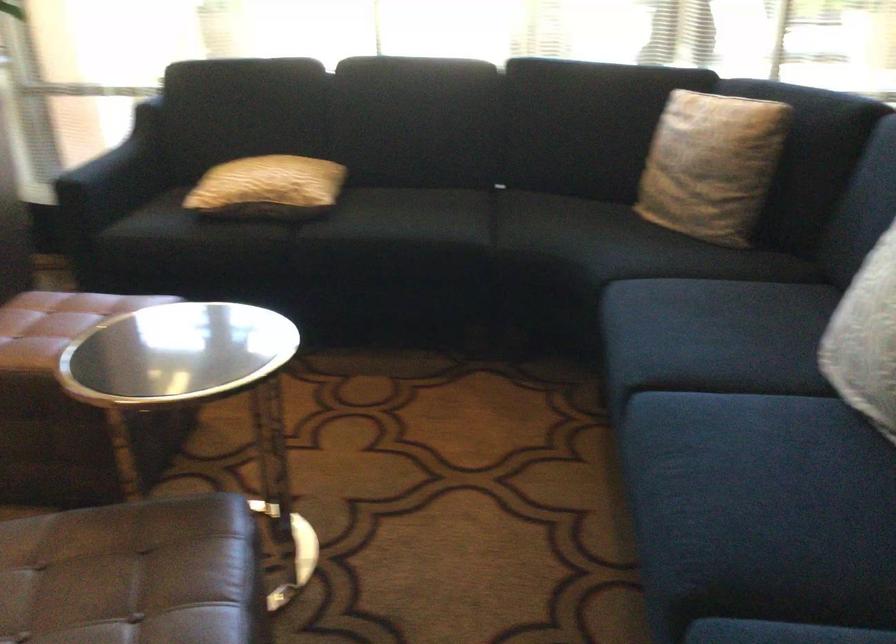
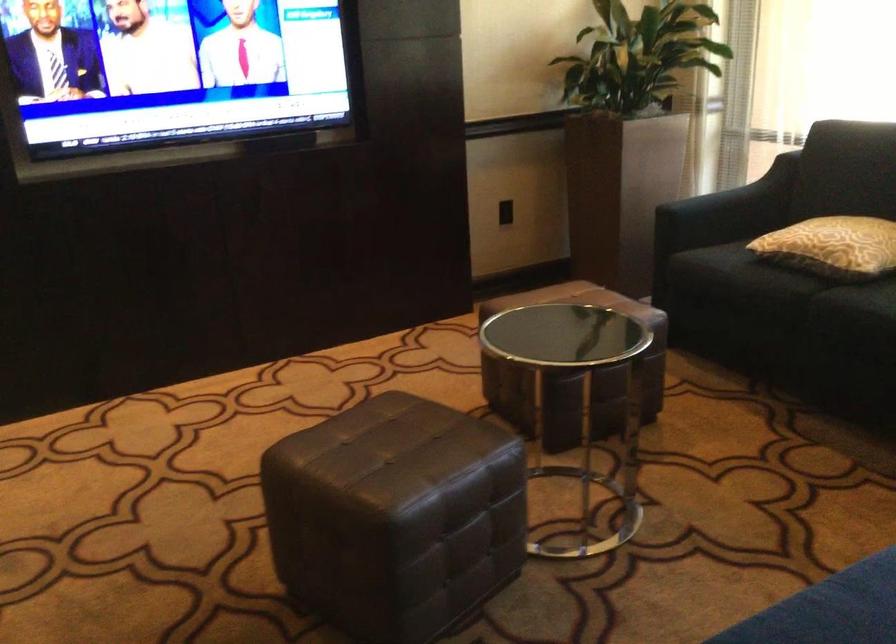
Where in the second image is the point corresponding to (x=288, y=190) from the first image?

(832, 245)